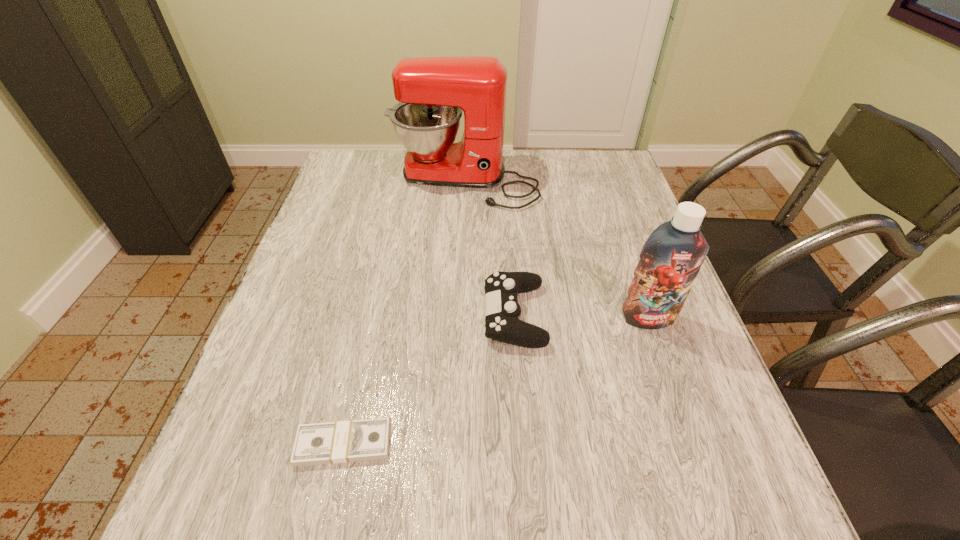
This screenshot has height=540, width=960. What are the coordinates of `kitchen mixer` in the screenshot? It's located at (432, 92).

In order to click on shampoo in this screenshot , I will do `click(671, 258)`.

Where is `the third shortest object`? Image resolution: width=960 pixels, height=540 pixels. the third shortest object is located at coordinates [671, 258].

This screenshot has width=960, height=540. I want to click on the second shortest object, so click(502, 310).

Find the location of a particular element. The width and height of the screenshot is (960, 540). the nearest object is located at coordinates (357, 440).

This screenshot has width=960, height=540. What are the coordinates of `dollar` in the screenshot? It's located at (357, 440).

What are the coordinates of `blank space located 0.110m on the front-facing side of the kitchen mixer` in the screenshot? It's located at (463, 237).

Find the location of a particular element. free region located 0.250m on the front label of the rightmost object is located at coordinates (692, 444).

The image size is (960, 540). Identify the location of vacant space located 0.370m on the surface of the control. (317, 315).

Where is `vacant space positioned on the surface of the control`? vacant space positioned on the surface of the control is located at coordinates (420, 315).